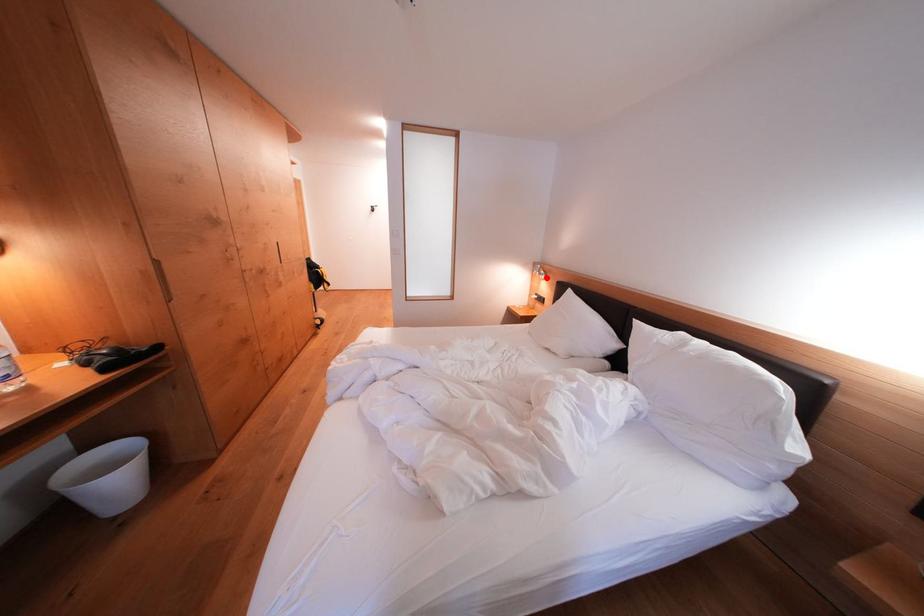
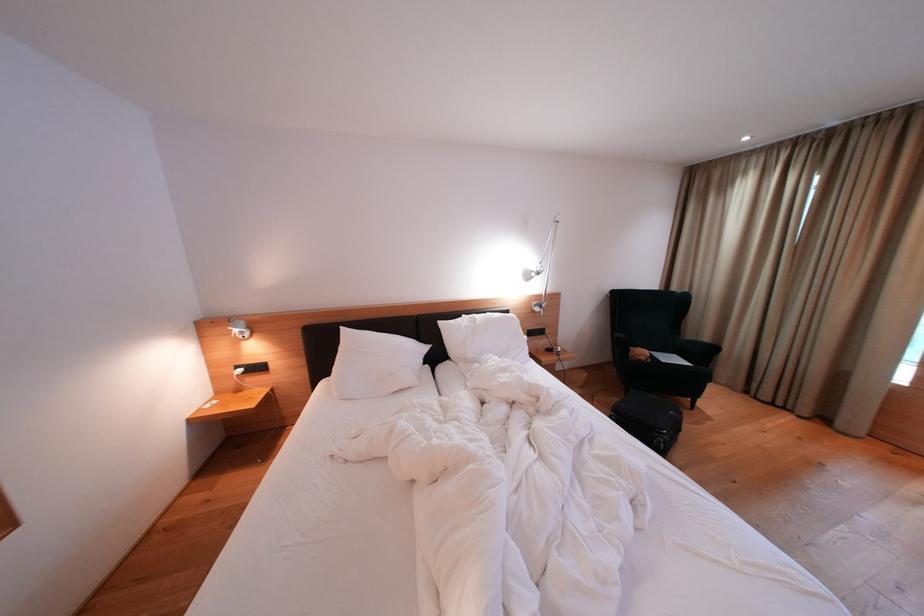
Find the pixel in the second image that matches the highlighted location in the first image.

(249, 336)